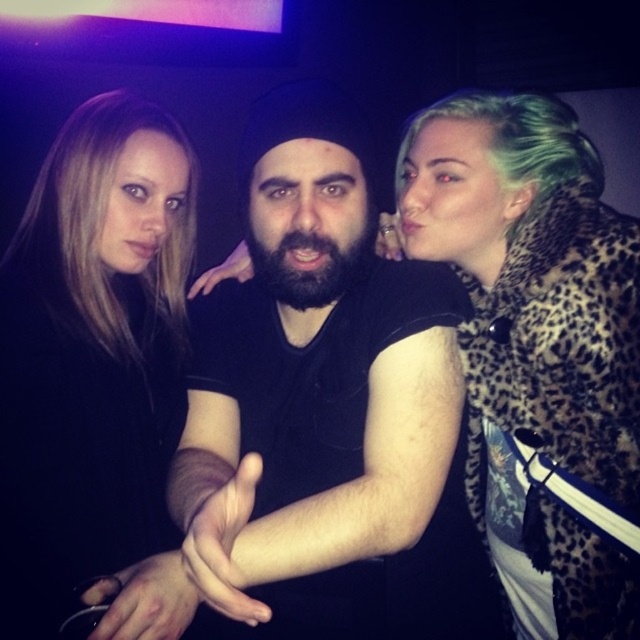
Which is in front, point (406, 628) or point (589, 268)?

Point (589, 268)

How distant is black matte shirt at center from leopard print coat at right?

The distance of black matte shirt at center from leopard print coat at right is 8.86 inches.

Between point (260, 124) and point (465, 340), which one is positioned behind?

Positioned behind is point (465, 340).

Locate an element on the screen. The image size is (640, 640). black matte shirt at center is located at coordinates tap(340, 378).

Between black matte shirt at center and matte black shirt at center, which one appears on the left side from the viewer's perspective?

Positioned to the left is matte black shirt at center.

Is black matte shirt at center behind matte black shirt at center?

No, black matte shirt at center is closer to the viewer.

Which is behind, point (344, 212) or point (72, 570)?

Point (72, 570)

Where is `black matte shirt at center`? black matte shirt at center is located at coordinates (340, 378).

Based on the photo, can you confirm if leopard print coat at right is positioned to the right of matte black shirt at center?

Indeed, leopard print coat at right is positioned on the right side of matte black shirt at center.

Which of these two, leopard print coat at right or matte black shirt at center, stands shorter?

Standing shorter between the two is matte black shirt at center.

What are the coordinates of `leopard print coat at right` in the screenshot? It's located at (536, 349).